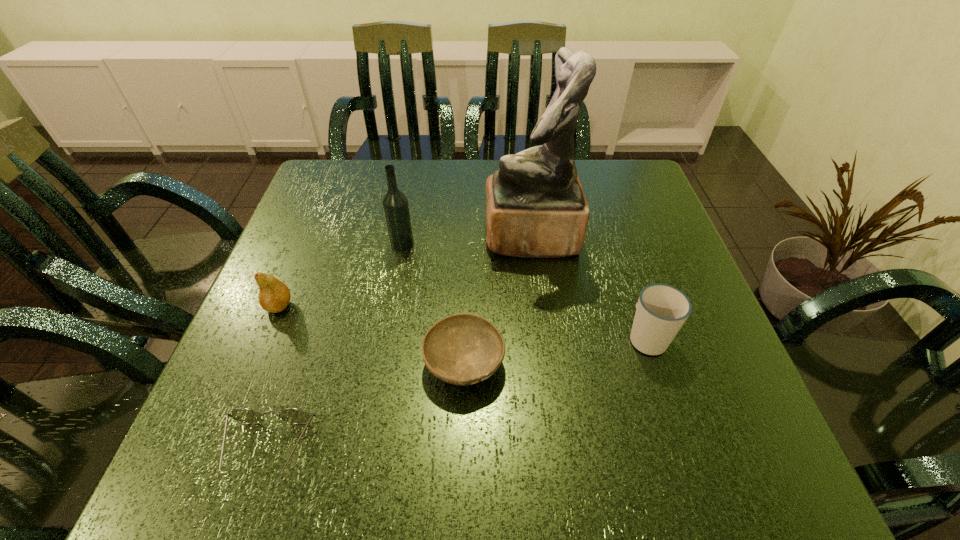
You are a GUI agent. You are given a task and a screenshot of the screen. Output one action in this format:
    pyautogui.click(x=<x>, y=<y>)
    Task: Click on the blank area in the image that satisfies the following two spatial constraints: 1. in a relaxed pose on the sculpture; 2. on the front side of the pear
    The height and width of the screenshot is (540, 960).
    Given the screenshot: What is the action you would take?
    pyautogui.click(x=540, y=306)

The image size is (960, 540). Find the location of `free location that satisfies the following two spatial constraints: 1. in a relaxed pose on the sculpture; 2. on the front-facing side of the nearest object`. free location that satisfies the following two spatial constraints: 1. in a relaxed pose on the sculpture; 2. on the front-facing side of the nearest object is located at coordinates (x=558, y=450).